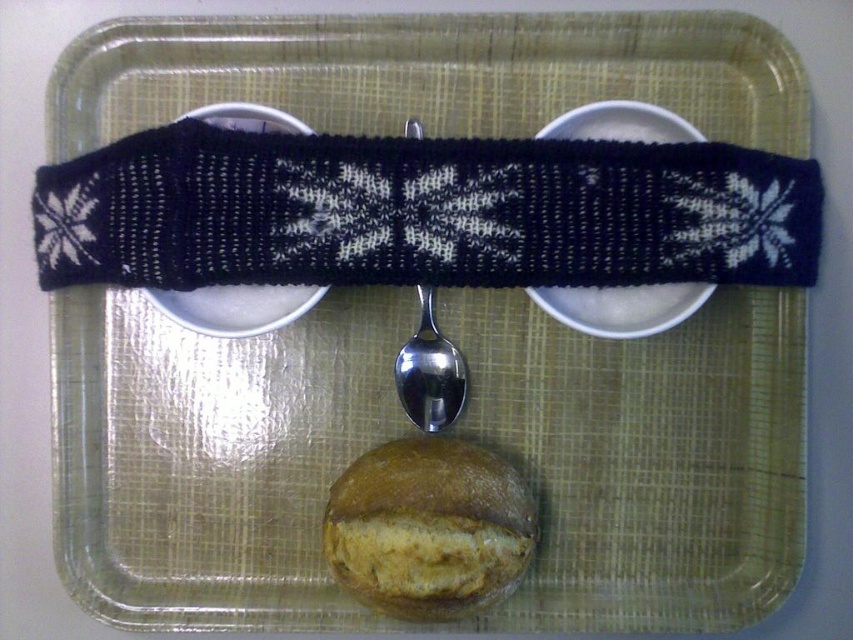
You are organizing a gift basket and need to decide which item to place on top. Which of the two items, the black knitted band at upper center or the black knitted plate at center, is bigger in size?

The black knitted band at upper center is larger in size compared to the black knitted plate at center, so it should be placed on top.

You are arranging items on a tray for a tea party. You have a golden brown crusty bread at center and a satin silver spoon at center. According to the image, where should you place the bread relative to the spoon to match the arrangement?

The golden brown crusty bread at center should be placed to the right of the satin silver spoon at center to match the arrangement.

You are arranging items on a tray for a presentation. You need to place a decorative item closer to the audience. Which item should you choose between the black knitted band at upper center and the black knitted plate at center?

The black knitted band at upper center is closer to the viewer, so it should be chosen for the presentation as it will be more visible to the audience.